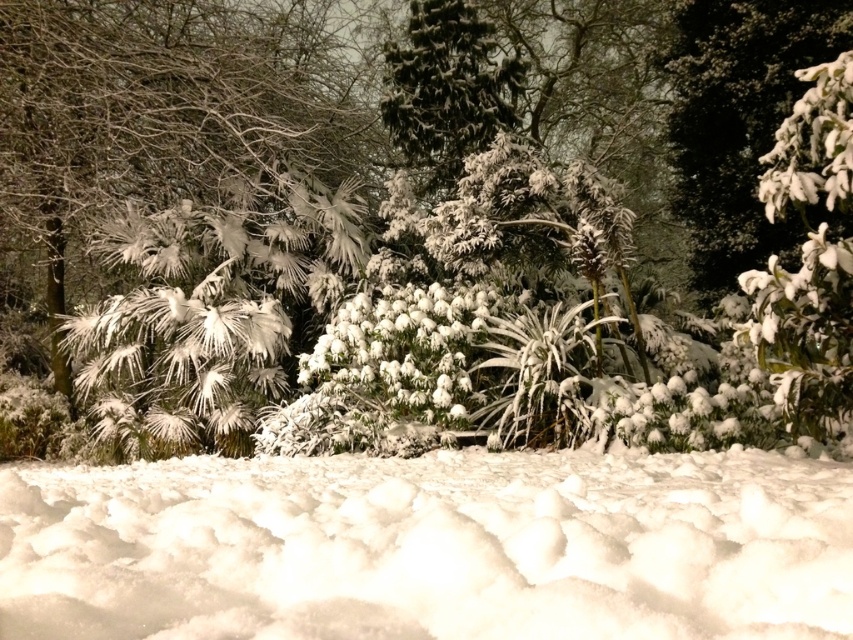
Based on the photo, you are standing in the winter scene described. You want to place a small snowman exactly at the point marked by the coordinates point (430, 547). What is the terrain like at that location?

The point (430, 547) is marked as white fluffy snow at lower center, which is suitable for building a snowman as it provides a stable base.

You are standing in the winter scene and want to take a photo of the white fluffy snow at lower center and the white fluffy snow at upper right. Which one will appear closer to you in the photo?

The white fluffy snow at lower center will appear closer to you in the photo because it is positioned in front of the white fluffy snow at upper right.